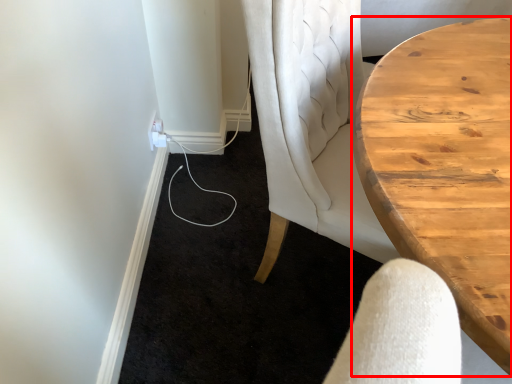
Question: In this image, where is table (annotated by the red box) located relative to electric outlet?

Choices:
 (A) right
 (B) left

Answer: (A)